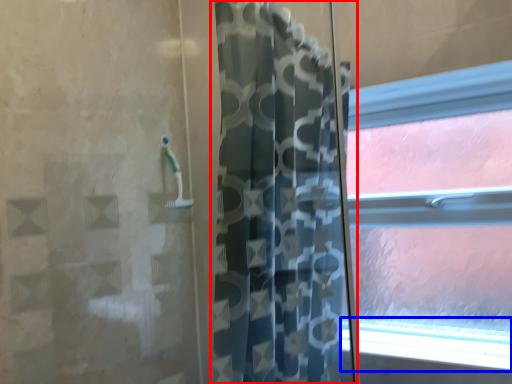
Question: Which object appears farthest to the camera in this image, curtain (highlighted by a red box) or window sill (highlighted by a blue box)?

Choices:
 (A) curtain
 (B) window sill

Answer: (B)